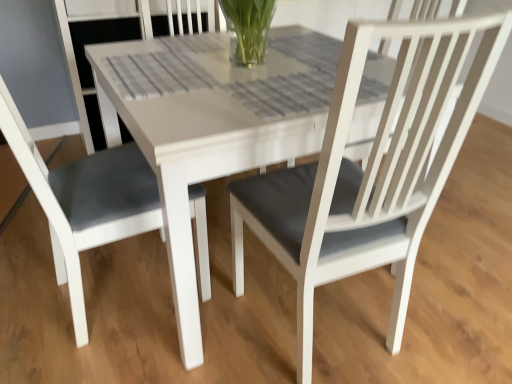
At what (x,y) coordinates should I click in order to perform the action: click on free space above white matte table at center (from a real-world perspective). Please return your answer as a coordinate pair (x, y). This screenshot has width=512, height=384. Looking at the image, I should click on (244, 74).